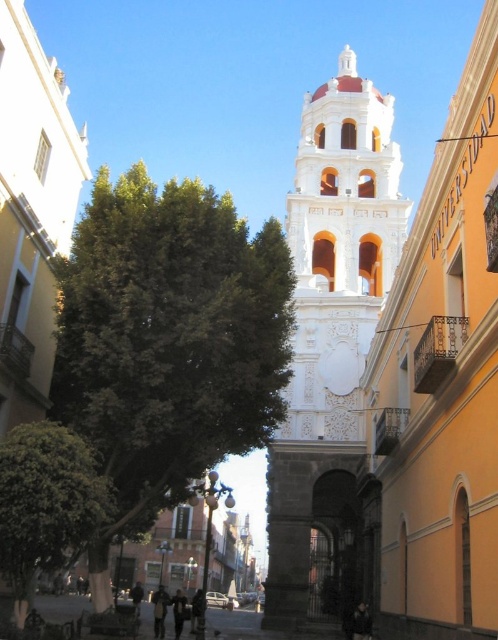
Is white ornate tower at center wider than green leafy tree at center?

No.

At what (x,y) coordinates should I click in order to perform the action: click on white ornate tower at center. Please return your answer as a coordinate pair (x, y). Looking at the image, I should click on (442, 385).

Where is `white ornate tower at center`? white ornate tower at center is located at coordinates (442, 385).

Which is below, white ornate bell tower at center or dark gray fabric jacket at center?

dark gray fabric jacket at center is lower down.

Who is taller, white ornate bell tower at center or dark gray fabric jacket at center?

With more height is white ornate bell tower at center.

Is point (308, 275) positioned behind point (181, 627)?

Yes, point (308, 275) is behind point (181, 627).

Where is `white ornate bell tower at center`? Image resolution: width=498 pixels, height=640 pixels. white ornate bell tower at center is located at coordinates (331, 340).

Which is below, white ornate tower at center or white marble church at center?

white ornate tower at center is lower down.

Can you confirm if white ornate tower at center is positioned to the left of white marble church at center?

No, white ornate tower at center is not to the left of white marble church at center.

At what (x,y) coordinates should I click in order to perform the action: click on white ornate tower at center. Please return your answer as a coordinate pair (x, y). Looking at the image, I should click on (442, 385).